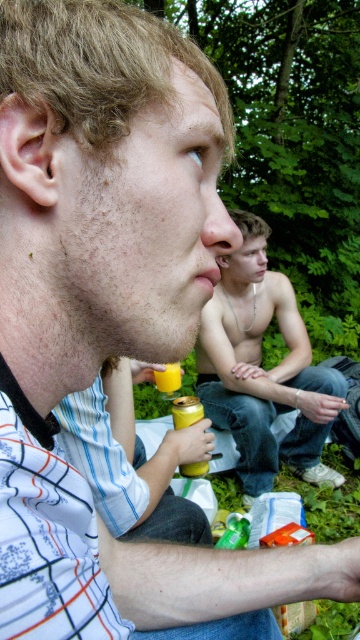
You are planning to pack a picnic basket and have both the shiny metallic can at center and the yellow matte can at lower center. Which can will take up more space in the basket?

The shiny metallic can at center is larger in size compared to the yellow matte can at lower center, so it will take up more space in the basket.

Based on the photo, you are standing at point (176, 384) and want to move to point (236, 428). Is the path directly between these two points clear of any obstructions?

The path between point (236, 428) and point (176, 384) is clear because there are no objects mentioned in the scene that would block the path between them.

Looking at this image, you are planning to place a 12 inch wide decorative mat between the shiny metallic can at center and the yellow matte cup at lower center. Will there be enough space for the mat to fit between them without overlapping either object?

The shiny metallic can at center and yellow matte cup at lower center are 26.82 inches apart from each other. Since the mat is 12 inches wide, there is sufficient space as 26.82 inches is greater than 12 inches. The mat can be placed between them without overlapping.